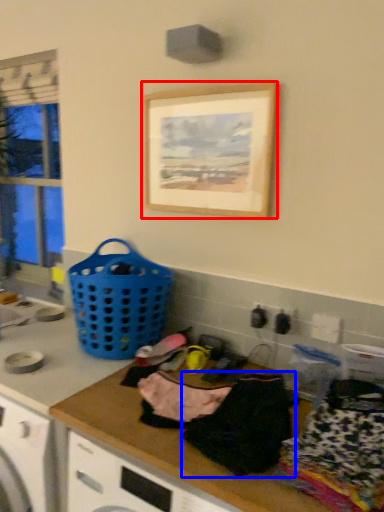
Question: Which object appears closest to the camera in this image, picture frame (highlighted by a red box) or clothing (highlighted by a blue box)?

Choices:
 (A) picture frame
 (B) clothing

Answer: (B)